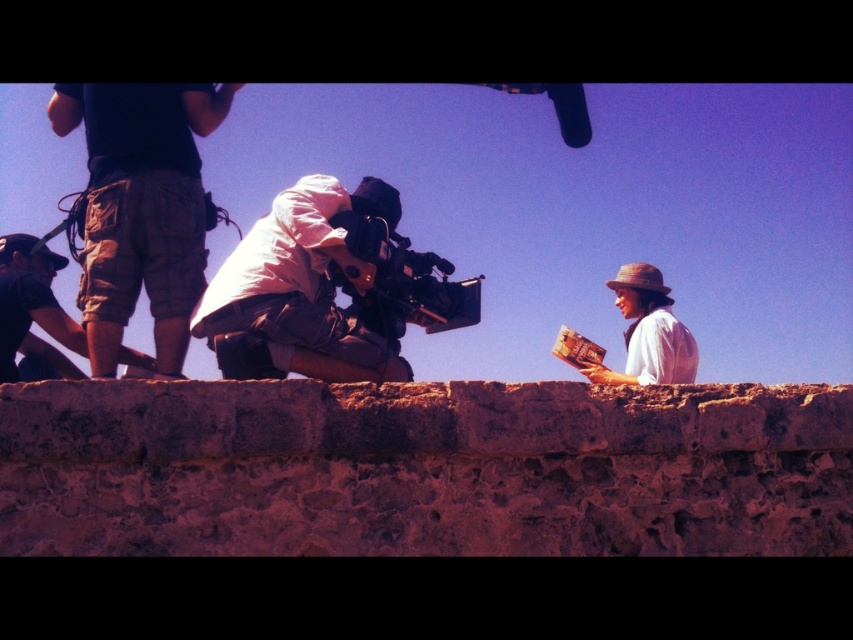
Question: Can you confirm if matte white camera at center is positioned below black matte video camera at center?

Choices:
 (A) yes
 (B) no

Answer: (B)

Question: Which point appears closest to the camera in this image?

Choices:
 (A) (167, 236)
 (B) (660, 307)
 (C) (341, 221)

Answer: (C)

Question: Is dark blue t-shirt at left above matte white camera at center?

Choices:
 (A) no
 (B) yes

Answer: (A)

Question: Considering the relative positions of dark blue t-shirt at left and black matte video camera at center in the image provided, where is dark blue t-shirt at left located with respect to black matte video camera at center?

Choices:
 (A) above
 (B) below

Answer: (A)

Question: Estimate the real-world distances between objects in this image. Which object is farther from the black matte video camera at center?

Choices:
 (A) matte white camera at center
 (B) matte straw hat at right

Answer: (B)

Question: Which object is farther from the camera taking this photo?

Choices:
 (A) black matte video camera at center
 (B) matte straw hat at right
 (C) matte white camera at center
 (D) dark blue t-shirt at left

Answer: (B)